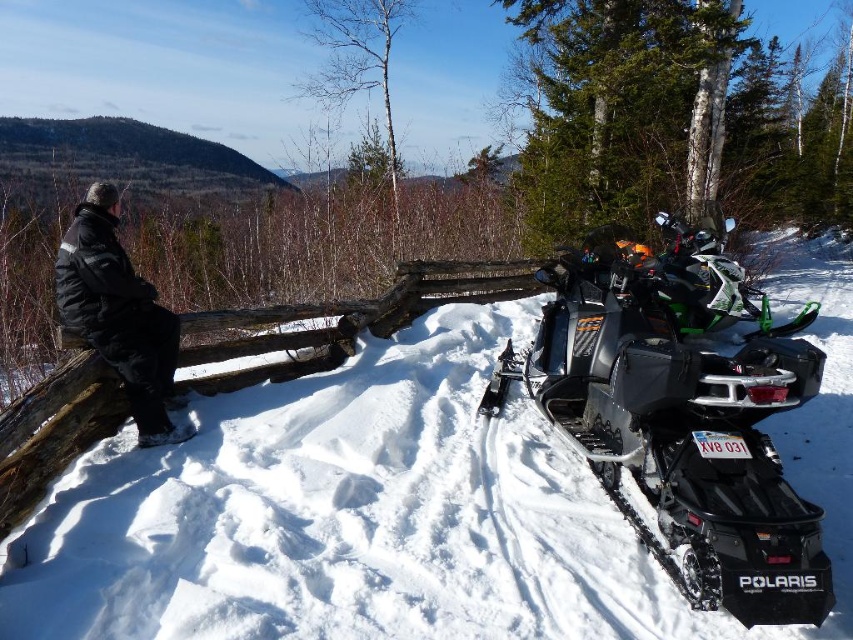
Question: Which point is closer to the camera?

Choices:
 (A) (343, 563)
 (B) (758, 420)

Answer: (B)

Question: Which point appears farthest from the camera in this image?

Choices:
 (A) (90, 250)
 (B) (724, 586)
 (C) (381, 509)

Answer: (A)

Question: Does white fluffy snow at center appear under black puffy jacket at left?

Choices:
 (A) yes
 (B) no

Answer: (A)

Question: Considering the relative positions of white fluffy snow at center and black puffy jacket at left in the image provided, where is white fluffy snow at center located with respect to black puffy jacket at left?

Choices:
 (A) above
 (B) below

Answer: (B)

Question: Observing the image, what is the correct spatial positioning of white fluffy snow at center in reference to black puffy jacket at left?

Choices:
 (A) below
 (B) above

Answer: (A)

Question: Which object appears closest to the camera in this image?

Choices:
 (A) black matte snowmobile at right
 (B) black puffy jacket at left
 (C) white fluffy snow at center

Answer: (A)